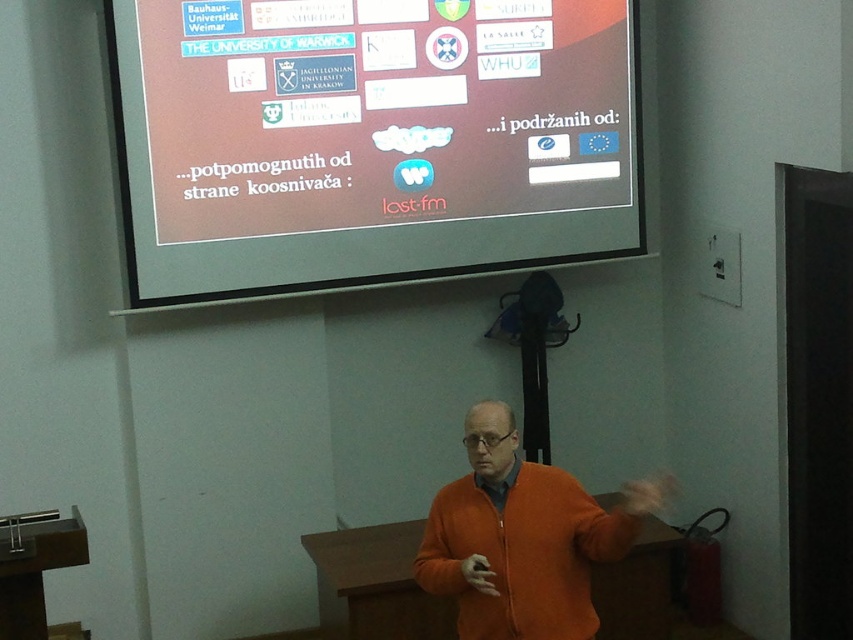
You are a student sitting at the front row of the lecture hall. You notice two points on the projection screen. One is at coordinates point (x=180, y=8) and the other is at point (x=654, y=508). Which point is closer to you?

Point (x=180, y=8) is behind point (x=654, y=508), so the point closer to you is point (x=654, y=508).